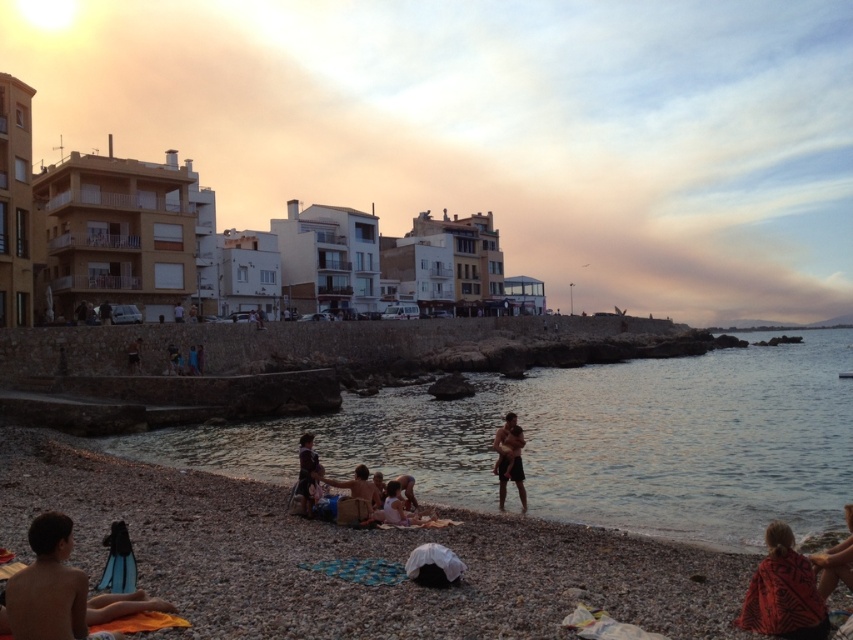
The image size is (853, 640). Find the location of `brown textured shorts at center`. brown textured shorts at center is located at coordinates (308, 474).

Who is higher up, brown textured shorts at center or dark brown leather jacket at center?

dark brown leather jacket at center is above.

Does point (309, 433) come farther from viewer compared to point (131, 356)?

No.

You are a GUI agent. You are given a task and a screenshot of the screen. Output one action in this format:
    pyautogui.click(x=<x>, y=<y>)
    Task: Click on the brown textured shorts at center
    
    Given the screenshot: What is the action you would take?
    pyautogui.click(x=308, y=474)

Who is more distant from viewer, [421,406] or [129,346]?

Positioned behind is point [421,406].

Is point (405, 429) closer to camera compared to point (131, 369)?

That is True.

Describe the element at coordinates (595, 442) in the screenshot. This screenshot has height=640, width=853. I see `clear water at lower center` at that location.

Locate an element on the screen. This screenshot has height=640, width=853. clear water at lower center is located at coordinates (595, 442).

Between point (194, 620) and point (498, 499), which one is positioned in front?

Positioned in front is point (194, 620).

Which is below, smooth pebble beach at lower left or smooth tan skin at center?

smooth pebble beach at lower left is below.

Between point (9, 544) and point (502, 484), which one is positioned behind?

Positioned behind is point (502, 484).

I want to click on smooth pebble beach at lower left, so click(x=352, y=556).